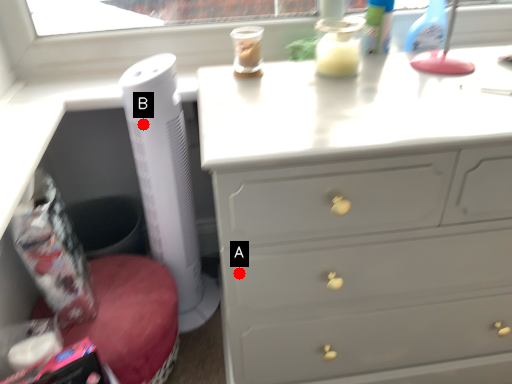
Question: Two points are circled on the image, labeled by A and B beside each circle. Among these points, which one is nearest to the camera?

Choices:
 (A) A is closer
 (B) B is closer

Answer: (A)